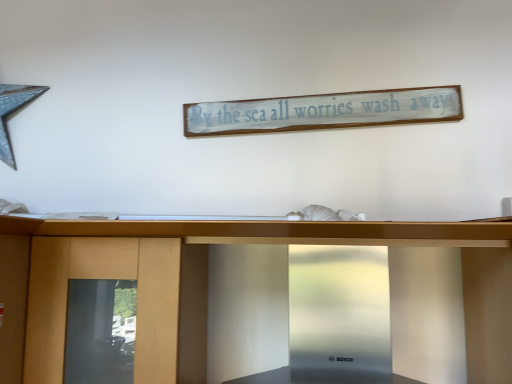
At what (x,y) coordinates should I click in order to perform the action: click on free space above white distressed wood signboard at upper center (from a real-world perspective). Please return your answer as a coordinate pair (x, y). Looking at the image, I should click on (326, 88).